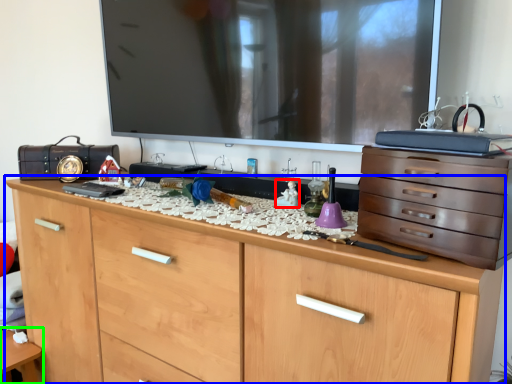
Question: Which object is the farthest from toy (highlighted by a red box)? Choose among these: chest of drawers (highlighted by a blue box) or table (highlighted by a green box).

Choices:
 (A) chest of drawers
 (B) table

Answer: (B)